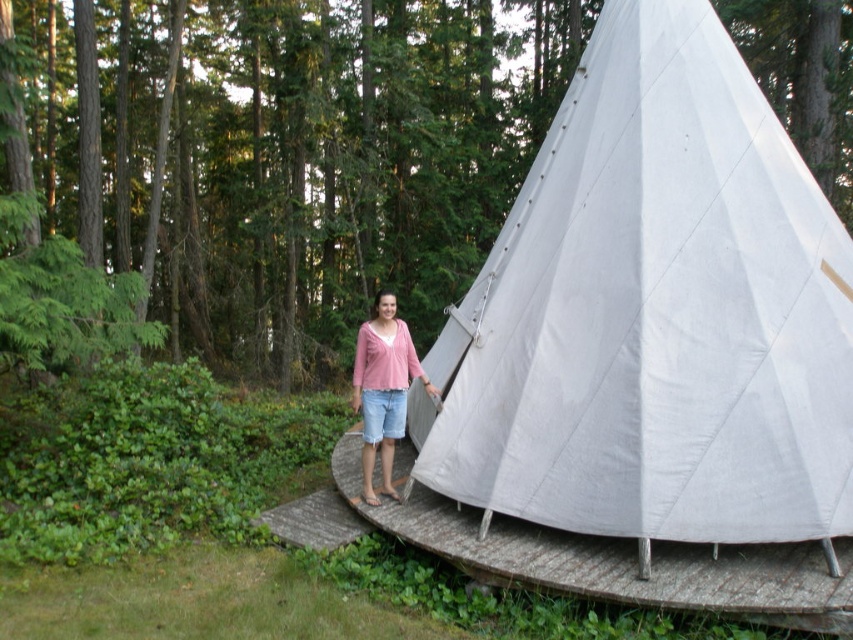
Question: Which object appears closest to the camera in this image?

Choices:
 (A) white canvas tent at center
 (B) white fabric ramp at lower center

Answer: (B)

Question: Is white canvas tent at center thinner than matte pink sweater at center?

Choices:
 (A) yes
 (B) no

Answer: (B)

Question: Which object appears closest to the camera in this image?

Choices:
 (A) matte pink sweater at center
 (B) white fabric ramp at lower center

Answer: (B)

Question: Is white fabric ramp at lower center above matte pink sweater at center?

Choices:
 (A) no
 (B) yes

Answer: (A)

Question: Does white canvas tent at center appear on the left side of matte pink sweater at center?

Choices:
 (A) yes
 (B) no

Answer: (B)

Question: Which object is closer to the camera taking this photo?

Choices:
 (A) matte pink sweater at center
 (B) white canvas tent at center

Answer: (B)